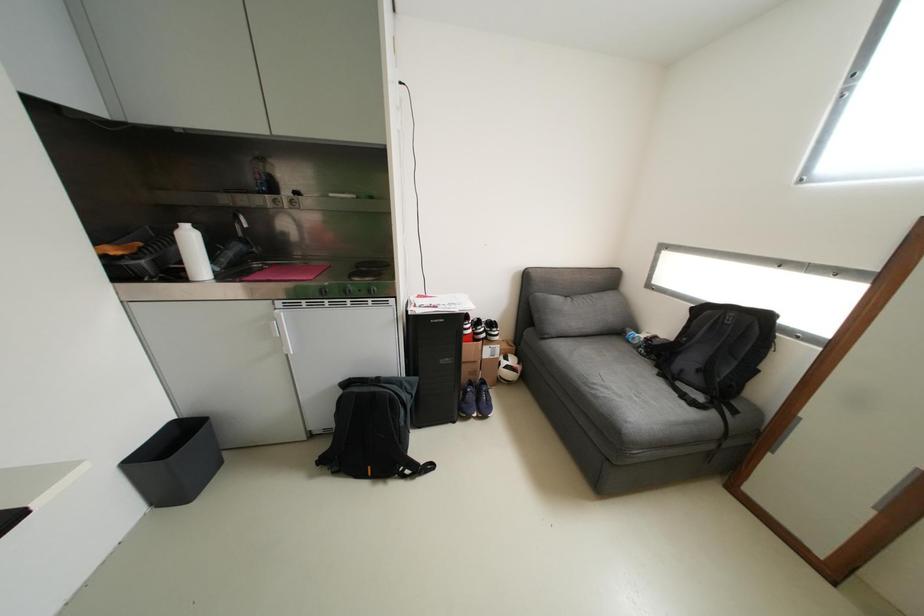
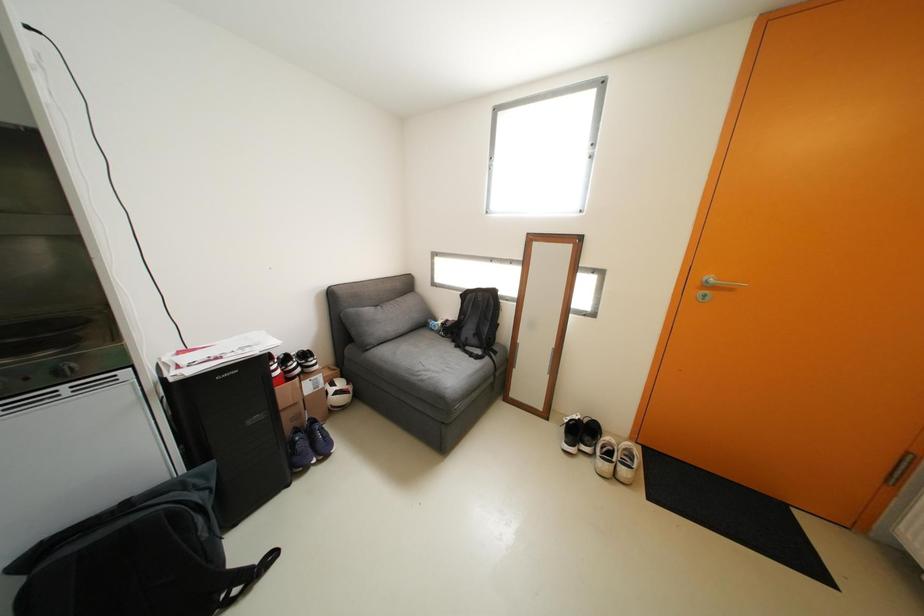
Question: Based on the continuous images, in which direction is the camera rotating? Reply with the corresponding letter.

Choices:
 (A) Left
 (B) Right
 (C) Up
 (D) Down

Answer: (B)